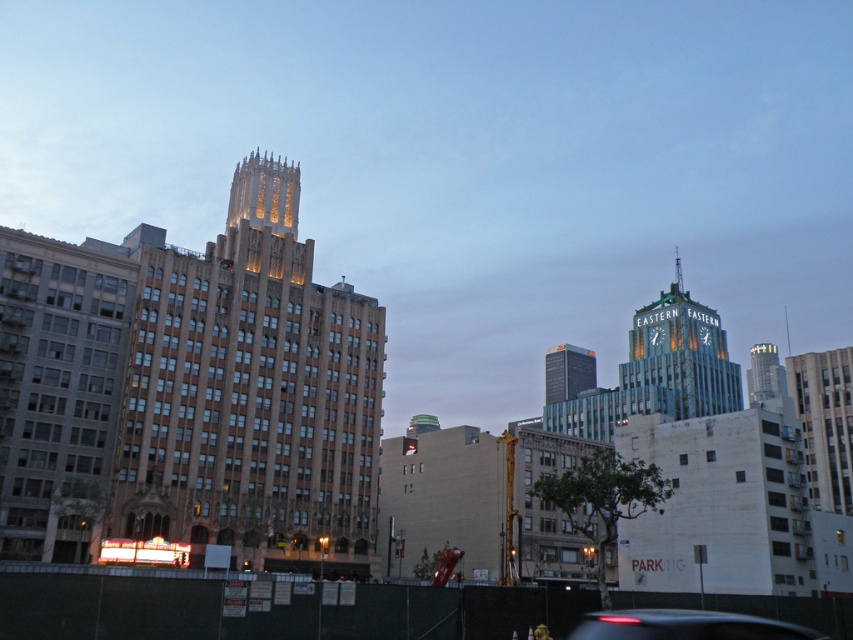
Question: Is black glossy car at lower center below glass skyscraper at upper right?

Choices:
 (A) yes
 (B) no

Answer: (A)

Question: Estimate the real-world distances between objects in this image. Which object is closer to the green glass skyscraper at center?

Choices:
 (A) blue glass clock tower at upper right
 (B) brown stone building at center
 (C) black glossy car at lower center
 (D) glass skyscraper at upper right

Answer: (A)

Question: Does brown stone building at center have a lesser width compared to blue glass clock tower at upper right?

Choices:
 (A) no
 (B) yes

Answer: (B)

Question: Which point is closer to the camera?

Choices:
 (A) (665, 621)
 (B) (129, 376)
 (C) (677, 262)

Answer: (A)

Question: Which object appears closest to the camera in this image?

Choices:
 (A) green glass skyscraper at center
 (B) glass skyscraper at upper right
 (C) blue glass clock tower at upper right

Answer: (C)

Question: In this image, where is brown stone building at center located relative to blue glass clock tower at upper right?

Choices:
 (A) right
 (B) left

Answer: (B)